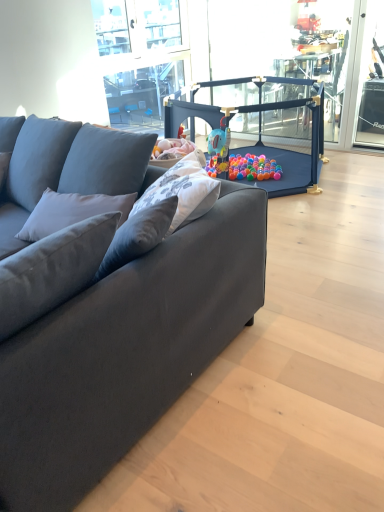
Question: Should I look upward or downward to see clear glass window screen at right?

Choices:
 (A) down
 (B) up

Answer: (B)

Question: Is suede dark gray couch at left with matte blue playpen at center?

Choices:
 (A) yes
 (B) no

Answer: (B)

Question: Is matte blue playpen at center completely or partially inside suede dark gray couch at left?

Choices:
 (A) yes
 (B) no

Answer: (B)

Question: Is suede dark gray couch at left shorter than matte blue playpen at center?

Choices:
 (A) yes
 (B) no

Answer: (B)

Question: Considering the relative sizes of suede dark gray couch at left and matte blue playpen at center in the image provided, is suede dark gray couch at left taller than matte blue playpen at center?

Choices:
 (A) no
 (B) yes

Answer: (B)

Question: From a real-world perspective, is suede dark gray couch at left beneath matte blue playpen at center?

Choices:
 (A) yes
 (B) no

Answer: (B)

Question: Considering the relative positions of suede dark gray couch at left and matte blue playpen at center in the image provided, is suede dark gray couch at left behind matte blue playpen at center?

Choices:
 (A) no
 (B) yes

Answer: (A)

Question: Is matte blue playpen at center oriented towards clear glass window screen at right?

Choices:
 (A) yes
 (B) no

Answer: (B)

Question: Is matte blue playpen at center turned away from clear glass window screen at right?

Choices:
 (A) no
 (B) yes

Answer: (A)

Question: Does matte blue playpen at center have a lesser height compared to clear glass window screen at right?

Choices:
 (A) no
 (B) yes

Answer: (B)

Question: Is clear glass window screen at right located within matte blue playpen at center?

Choices:
 (A) yes
 (B) no

Answer: (B)

Question: From a real-world perspective, is matte blue playpen at center physically above clear glass window screen at right?

Choices:
 (A) no
 (B) yes

Answer: (A)

Question: From a real-world perspective, is matte blue playpen at center beneath clear glass window screen at right?

Choices:
 (A) yes
 (B) no

Answer: (A)

Question: Is matte blue playpen at center bigger than suede dark gray couch at left?

Choices:
 (A) no
 (B) yes

Answer: (A)